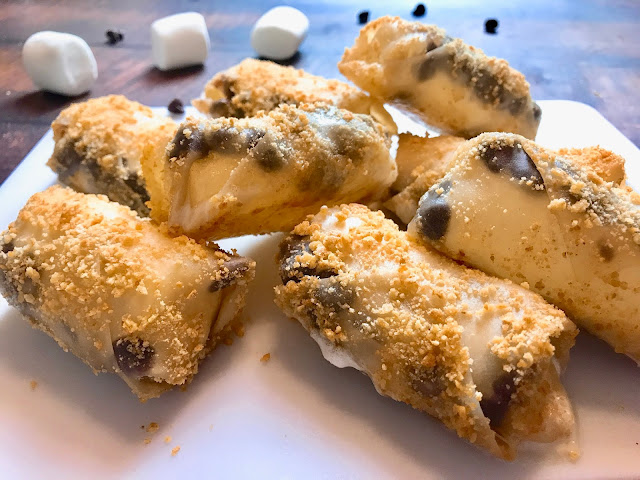
This screenshot has width=640, height=480. Identify the location of white plate. (573, 128).